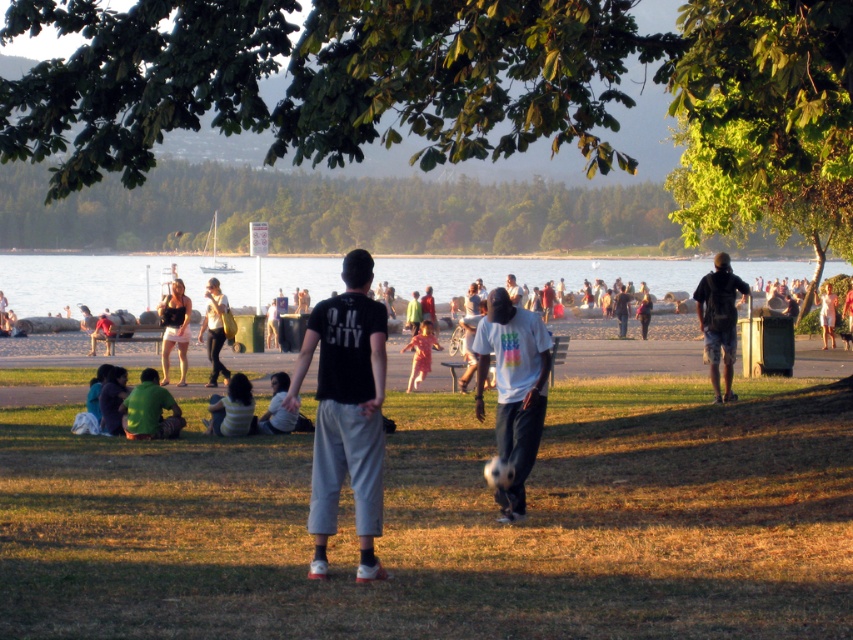
Which is more to the left, black cotton t-shirt at center or matte yellow shirt at center?

Positioned to the left is matte yellow shirt at center.

Who is positioned more to the right, black cotton t-shirt at center or matte yellow shirt at center?

black cotton t-shirt at center

What do you see at coordinates (346, 412) in the screenshot? This screenshot has height=640, width=853. I see `black cotton t-shirt at center` at bounding box center [346, 412].

The image size is (853, 640). I want to click on black cotton t-shirt at center, so click(x=346, y=412).

Is green matte shirt at lower left thinner than striped shirt at center?

In fact, green matte shirt at lower left might be wider than striped shirt at center.

Is green matte shirt at lower left closer to the viewer compared to striped shirt at center?

Yes, green matte shirt at lower left is closer to the viewer.

Which is behind, point (125, 404) or point (236, 388)?

The point (236, 388) is more distant.

At what (x,y) coordinates should I click in order to perform the action: click on green matte shirt at lower left. Please return your answer as a coordinate pair (x, y). The width and height of the screenshot is (853, 640). Looking at the image, I should click on (149, 410).

Which of these two, white matte shirt at center or camouflage shorts at right, stands shorter?

With less height is white matte shirt at center.

Image resolution: width=853 pixels, height=640 pixels. What do you see at coordinates (514, 388) in the screenshot?
I see `white matte shirt at center` at bounding box center [514, 388].

Identify the location of white matte shirt at center. (514, 388).